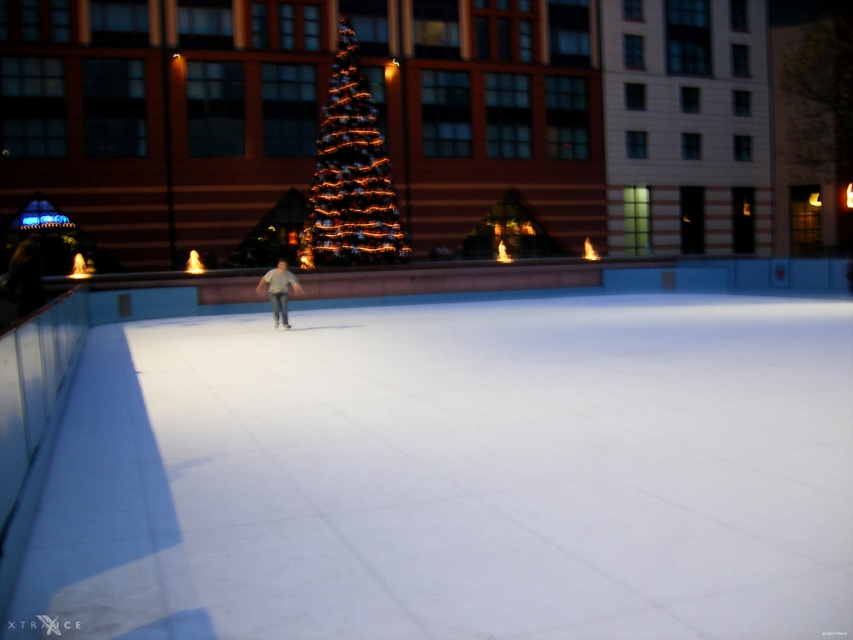
You are at an ice skating rink and notice two objects at the center of the scene. Which one is smaller between the illuminated glass christmas tree at center and the light gray cotton shirt at center?

The illuminated glass christmas tree at center is smaller than the light gray cotton shirt at center.

You are standing at the camera position and want to take a photo of the illuminated glass christmas tree at center. If your camera has a maximum focus range of 80 feet, will you be able to capture the tree clearly?

The illuminated glass christmas tree at center and camera are 88.85 feet apart from each other. Since the distance exceeds the camera maximum focus range of 80 feet, you will not be able to capture the tree clearly.

You are standing at point (350, 176) in the image. What object is located at this point?

The illuminated glass christmas tree at center is located at point (350, 176).